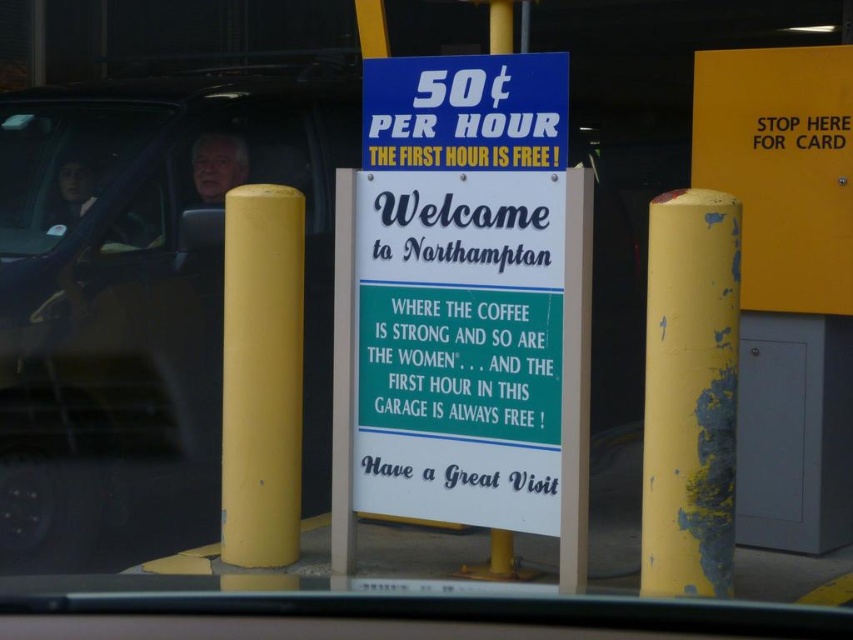
Is point (809, 284) farther from viewer compared to point (38, 253)?

That is False.

Between yellow matte sign at right and matte black car window at left, which one is positioned lower?

Positioned lower is yellow matte sign at right.

Who is more distant from viewer, (695, 166) or (86, 180)?

The point (86, 180) is behind.

This screenshot has width=853, height=640. Find the location of `yellow matte sign at right`. yellow matte sign at right is located at coordinates (781, 168).

Does matte black suv at left appear on the left side of yellow matte pole at left?

Indeed, matte black suv at left is positioned on the left side of yellow matte pole at left.

Who is positioned more to the left, matte black suv at left or yellow matte pole at left?

matte black suv at left is more to the left.

Locate an element on the screen. The height and width of the screenshot is (640, 853). matte black suv at left is located at coordinates click(143, 301).

You are a GUI agent. You are given a task and a screenshot of the screen. Output one action in this format:
    pyautogui.click(x=<x>, y=<y>)
    Task: Click on the matte black suv at left
    
    Given the screenshot: What is the action you would take?
    pyautogui.click(x=143, y=301)

Can you confirm if matte black suv at left is shorter than peeling paint yellow post at right?

Incorrect, matte black suv at left's height does not fall short of peeling paint yellow post at right's.

Is the position of matte black suv at left more distant than that of peeling paint yellow post at right?

Yes, it is.

Which is behind, point (187, 358) or point (726, 420)?

The point (187, 358) is behind.

Locate an element on the screen. The width and height of the screenshot is (853, 640). matte black suv at left is located at coordinates (143, 301).